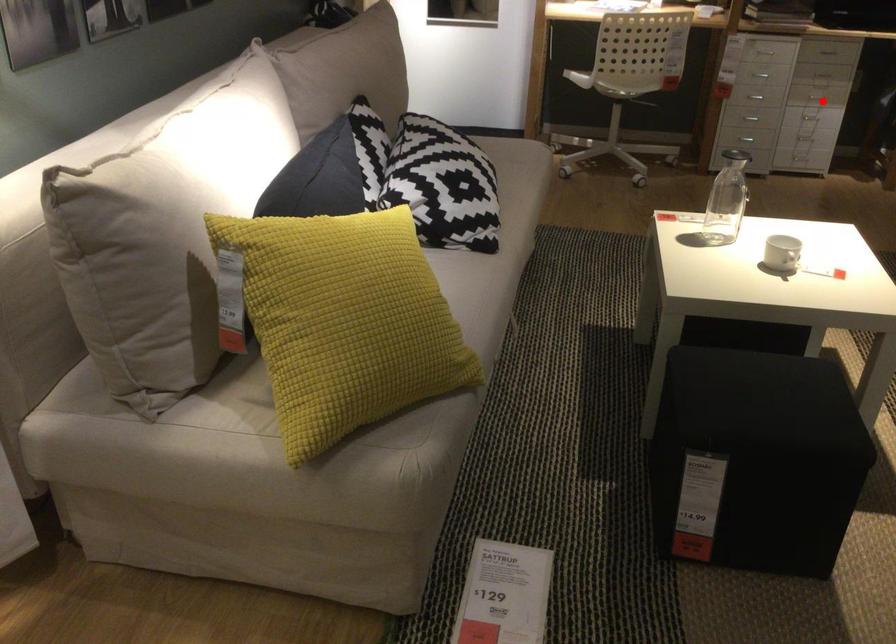
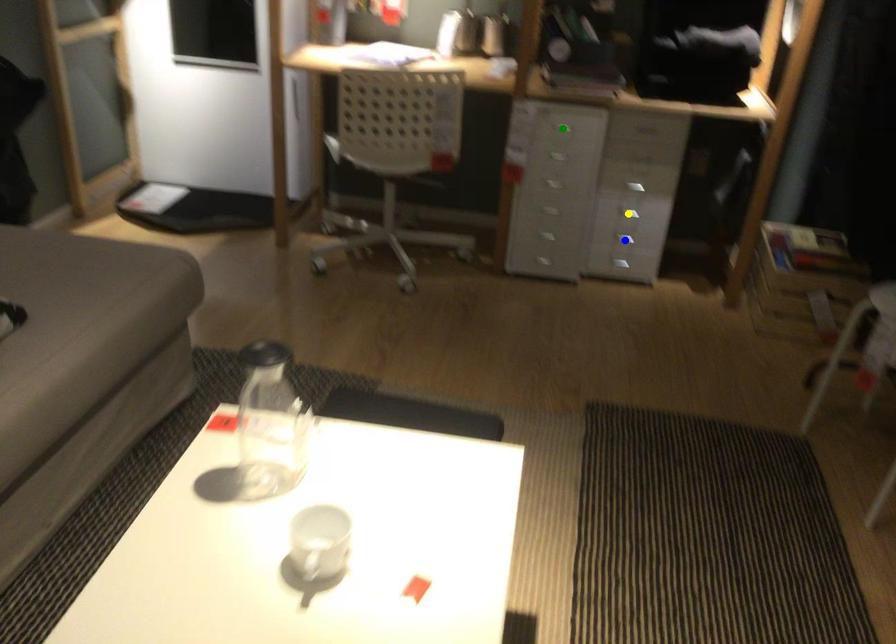
Question: I am providing you with two images of the same scene from different viewpoints. A red point is marked on the first image. You are given multiple points on the second image. Which mark in image 2 goes with the point in image 1?

Choices:
 (A) yellow point
 (B) blue point
 (C) green point

Answer: (A)